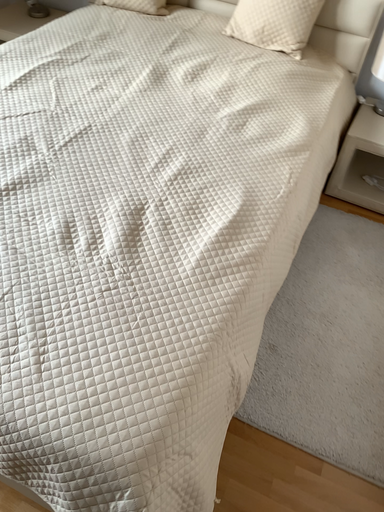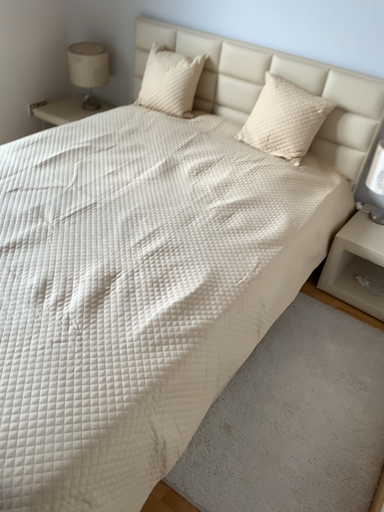
Question: Which way did the camera rotate in the video?

Choices:
 (A) rotated downward
 (B) rotated upward

Answer: (B)